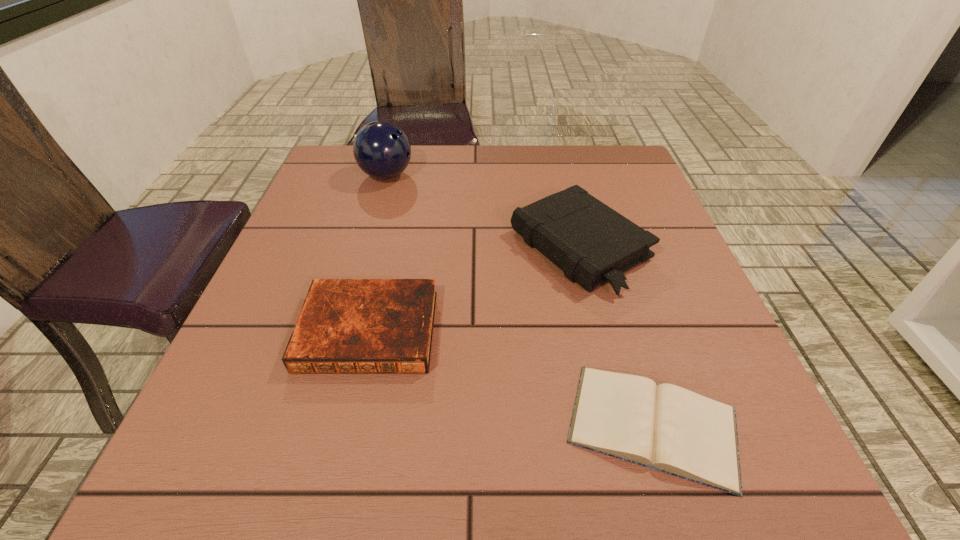
Locate an element on the screen. free region at the far left corner is located at coordinates (319, 178).

Where is `vacant position at the far right corner of the desktop`? The width and height of the screenshot is (960, 540). vacant position at the far right corner of the desktop is located at coordinates (629, 158).

Find the location of a particular element. The image size is (960, 540). free space at the near right corner of the desktop is located at coordinates (765, 454).

Where is `blank region between the third shortest object and the leftmost Bible`? This screenshot has height=540, width=960. blank region between the third shortest object and the leftmost Bible is located at coordinates (474, 289).

This screenshot has height=540, width=960. Find the location of `unoccupied area between the second tallest object and the tallest object`. unoccupied area between the second tallest object and the tallest object is located at coordinates (483, 212).

Where is `vacant space that is in between the leftmost Bible and the tallest Bible`? This screenshot has height=540, width=960. vacant space that is in between the leftmost Bible and the tallest Bible is located at coordinates (474, 289).

This screenshot has width=960, height=540. Find the location of `unoccupied position between the second shortest object and the shortest Bible`. unoccupied position between the second shortest object and the shortest Bible is located at coordinates (511, 377).

Locate an element on the screen. The image size is (960, 540). free spot between the shortest Bible and the second shortest object is located at coordinates pos(511,377).

Locate an element on the screen. The height and width of the screenshot is (540, 960). vacant area that lies between the third tallest object and the third shortest object is located at coordinates (474, 289).

Find the location of a particular element. vacant point located between the third tallest object and the shortest Bible is located at coordinates (511, 377).